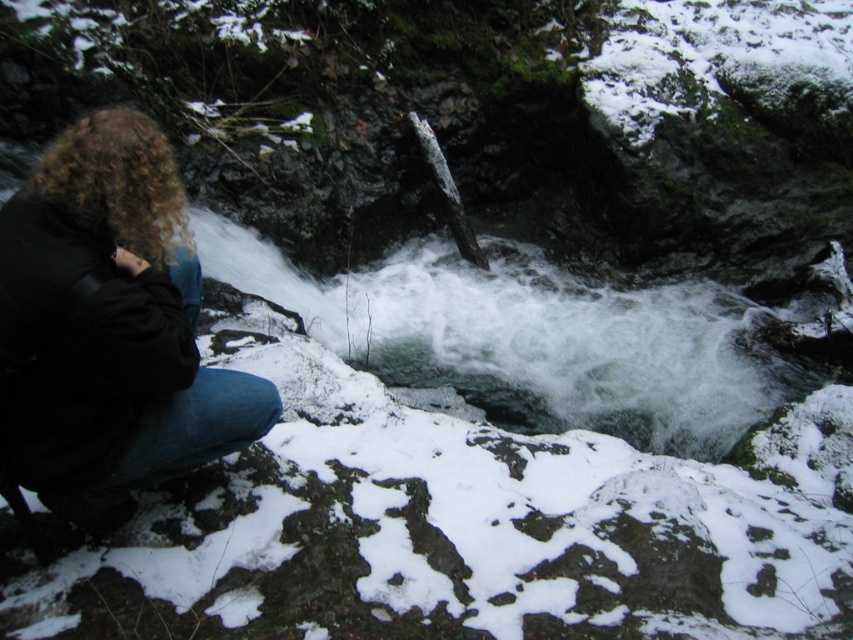
Is black leather jacket at left below white frothy water at center?

Yes.

Does black leather jacket at left come behind white frothy water at center?

That is False.

What do you see at coordinates (108, 328) in the screenshot? I see `black leather jacket at left` at bounding box center [108, 328].

Locate an element on the screen. black leather jacket at left is located at coordinates (108, 328).